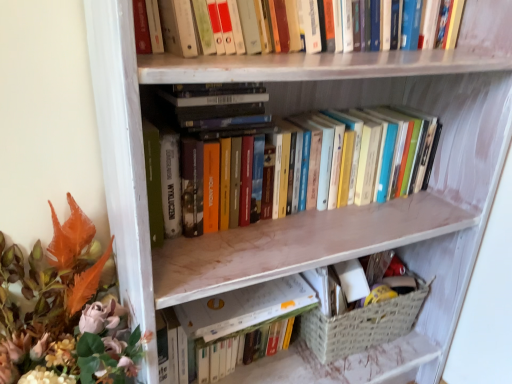
Question: In the image, is hardcover book at center positioned in front of or behind matte orange leaves at left?

Choices:
 (A) behind
 (B) front

Answer: (A)

Question: Is point (231, 319) positioned closer to the camera than point (76, 291)?

Choices:
 (A) closer
 (B) farther

Answer: (B)

Question: Which object is the farthest from the hardcover book at center?

Choices:
 (A) woven beige basket at lower right
 (B) matte orange leaves at left
 (C) hardcover books at upper center, placed as the first book when sorted from top to bottom
 (D) hardcover books at center, which is the second book from top to bottom

Answer: (C)

Question: Estimate the real-world distances between objects in this image. Which object is closer to the hardcover book at center?

Choices:
 (A) hardcover books at upper center, which is the second book from bottom to top
 (B) hardcover books at center, the 1th book from the bottom
 (C) matte orange leaves at left
 (D) woven beige basket at lower right

Answer: (D)